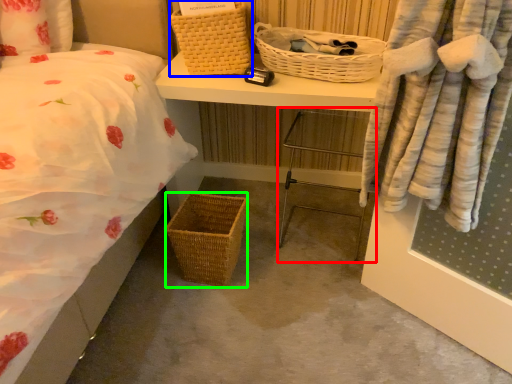
Question: Considering the real-world distances, which object is farthest from chair (highlighted by a red box)? picnic basket (highlighted by a blue box) or picnic basket (highlighted by a green box)?

Choices:
 (A) picnic basket
 (B) picnic basket

Answer: (A)